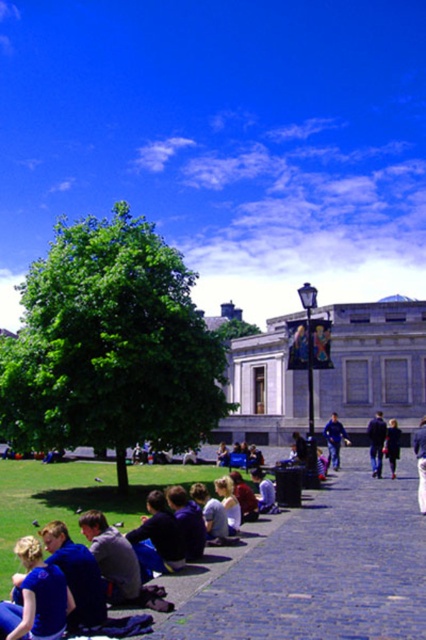
Which is behind, point (150, 566) or point (379, 458)?

The point (379, 458) is behind.

Measure the distance from dark blue shirt at lower left to dark blue jeans at center.

dark blue shirt at lower left and dark blue jeans at center are 27.61 meters apart from each other.

Where is `dark blue shirt at lower left`? Image resolution: width=426 pixels, height=640 pixels. dark blue shirt at lower left is located at coordinates point(157,538).

Which is in front, point (23, 586) or point (391, 436)?

Positioned in front is point (23, 586).

Between point (62, 620) and point (397, 436), which one is positioned behind?

The point (397, 436) is more distant.

Who is more distant from viewer, (26,538) or (393,452)?

Positioned behind is point (393,452).

Find the location of a particular element. blue fabric shirt at lower left is located at coordinates (37, 596).

Between blue denim jeans at lower right and dark blue jacket at center, which one appears on the left side from the viewer's perspective?

Positioned to the left is dark blue jacket at center.

Can you confirm if blue denim jeans at lower right is positioned to the right of dark blue jacket at center?

Correct, you'll find blue denim jeans at lower right to the right of dark blue jacket at center.

Which is in front, point (417, 492) or point (391, 456)?

Point (417, 492)

Where is `blue denim jeans at lower right`? The image size is (426, 640). blue denim jeans at lower right is located at coordinates (420, 461).